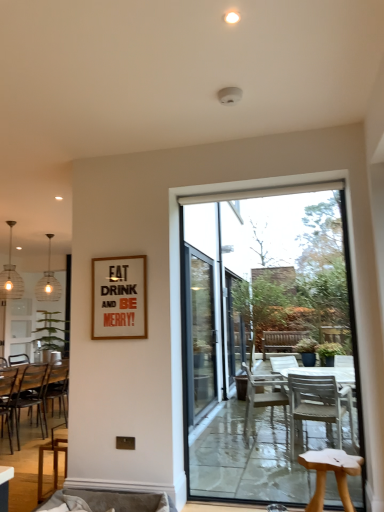
Question: Is wooden chair at left, acting as the 1th chair starting from the back, thinner than green leafy plant at left?

Choices:
 (A) yes
 (B) no

Answer: (A)

Question: Is wooden chair at left, acting as the 1th chair starting from the back, positioned with its back to green leafy plant at left?

Choices:
 (A) no
 (B) yes

Answer: (A)

Question: Is the position of wooden chair at left, acting as the 1th chair starting from the back, more distant than that of green leafy plant at left?

Choices:
 (A) yes
 (B) no

Answer: (B)

Question: Is wooden chair at left, which appears as the second chair when viewed from the left, taller than green leafy plant at left?

Choices:
 (A) yes
 (B) no

Answer: (A)

Question: Is wooden chair at left, which appears as the second chair when viewed from the left, far from green leafy plant at left?

Choices:
 (A) yes
 (B) no

Answer: (B)

Question: From the image's perspective, is wooden chair at left, which appears as the second chair when viewed from the left, on green leafy plant at left?

Choices:
 (A) yes
 (B) no

Answer: (B)

Question: Considering the relative sizes of light brown wooden stool at lower right and matte glass pendant light at left, the 1th lamp when ordered from front to back, in the image provided, is light brown wooden stool at lower right bigger than matte glass pendant light at left, the 1th lamp when ordered from front to back,?

Choices:
 (A) no
 (B) yes

Answer: (A)

Question: Considering the relative sizes of light brown wooden stool at lower right and matte glass pendant light at left, the 1th lamp when ordered from front to back, in the image provided, is light brown wooden stool at lower right wider than matte glass pendant light at left, the 1th lamp when ordered from front to back,?

Choices:
 (A) no
 (B) yes

Answer: (B)

Question: Considering the relative sizes of light brown wooden stool at lower right and matte glass pendant light at left, the 1th lamp when ordered from front to back, in the image provided, is light brown wooden stool at lower right thinner than matte glass pendant light at left, the 1th lamp when ordered from front to back,?

Choices:
 (A) no
 (B) yes

Answer: (A)

Question: Is light brown wooden stool at lower right looking in the opposite direction of matte glass pendant light at left, positioned as the 2th lamp in back-to-front order?

Choices:
 (A) no
 (B) yes

Answer: (A)

Question: Could you tell me if light brown wooden stool at lower right is facing matte glass pendant light at left, the 1th lamp when ordered from front to back?

Choices:
 (A) yes
 (B) no

Answer: (B)

Question: Is light brown wooden stool at lower right located outside matte glass pendant light at left, positioned as the 2th lamp in back-to-front order?

Choices:
 (A) yes
 (B) no

Answer: (A)

Question: From a real-world perspective, is green leafy plant at left under clear glass pendant light at left, which ranks as the second lamp in front-to-back order?

Choices:
 (A) yes
 (B) no

Answer: (A)